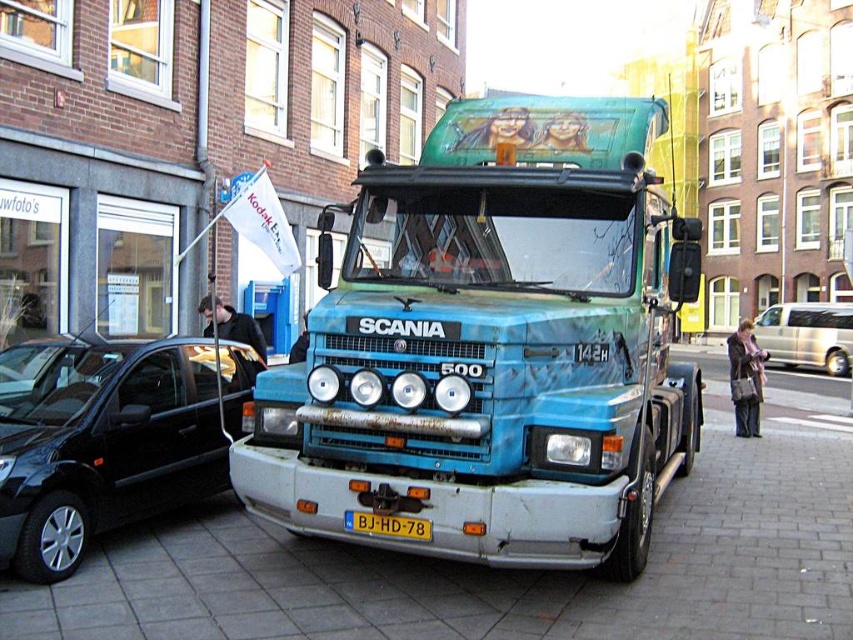
Question: Does shiny black car at left appear on the right side of yellow plastic license plate at center?

Choices:
 (A) yes
 (B) no

Answer: (B)

Question: Which point is closer to the camera taking this photo?

Choices:
 (A) (131, 397)
 (B) (590, 412)

Answer: (B)

Question: Which of the following is the closest to the observer?

Choices:
 (A) (389, 520)
 (B) (161, 346)
 (C) (759, 333)
 (D) (543, 413)

Answer: (A)

Question: Does blue metallic truck at center have a larger size compared to yellow plastic license plate at center?

Choices:
 (A) yes
 (B) no

Answer: (A)

Question: Which of the following is the closest to the observer?

Choices:
 (A) metallic silver van at right
 (B) yellow plastic license plate at center
 (C) blue metallic truck at center
 (D) shiny black car at left

Answer: (C)

Question: Does blue metallic truck at center have a larger size compared to shiny black car at left?

Choices:
 (A) no
 (B) yes

Answer: (A)